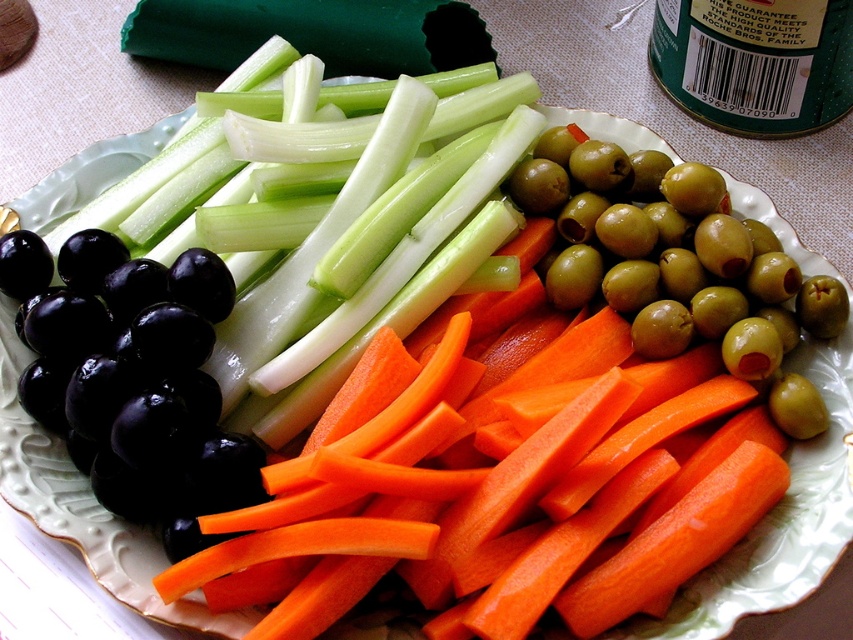
Can you confirm if orange smooth carrot at center is positioned to the right of shiny black grape at lower left?

Yes, orange smooth carrot at center is to the right of shiny black grape at lower left.

The image size is (853, 640). Identify the location of orange smooth carrot at center. (502, 496).

I want to click on orange smooth carrot at center, so 502,496.

Is green crisp celery at left below shiny black grape at lower left?

Incorrect, green crisp celery at left is not positioned below shiny black grape at lower left.

Is green crisp celery at left positioned at the back of shiny black grape at lower left?

Yes, green crisp celery at left is further from the viewer.

Identify the location of green crisp celery at left. (358, 237).

Between orange smooth carrot at center and green crisp celery at left, which one appears on the left side from the viewer's perspective?

From the viewer's perspective, green crisp celery at left appears more on the left side.

Between orange smooth carrot at center and green crisp celery at left, which one is positioned lower?

Positioned lower is orange smooth carrot at center.

Describe the element at coordinates (502, 496) in the screenshot. I see `orange smooth carrot at center` at that location.

I want to click on orange smooth carrot at center, so click(x=502, y=496).